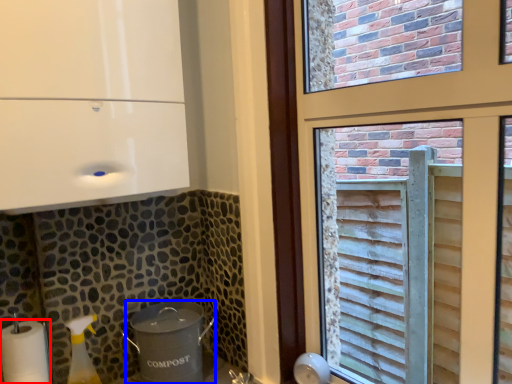
Question: Which object appears farthest to the camera in this image, paper towel (highlighted by a red box) or appliance (highlighted by a blue box)?

Choices:
 (A) paper towel
 (B) appliance

Answer: (B)